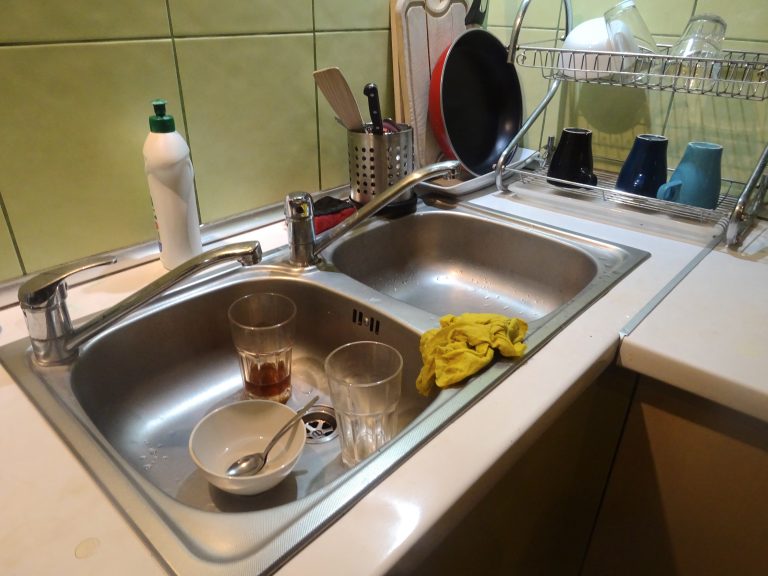
Image resolution: width=768 pixels, height=576 pixels. I want to click on cup, so [362, 409], [257, 328], [689, 170], [650, 166], [570, 147], [703, 41], [636, 36].